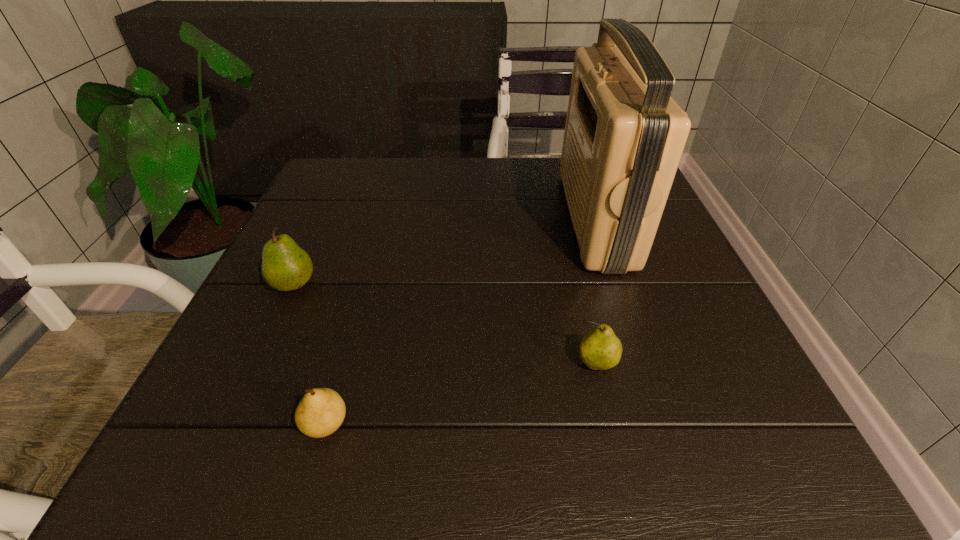
Where is `radio receiver`? radio receiver is located at coordinates (624, 136).

Locate an element on the screen. The width and height of the screenshot is (960, 540). the third shortest object is located at coordinates (285, 266).

You are a GUI agent. You are given a task and a screenshot of the screen. Output one action in this format:
    pyautogui.click(x=<x>, y=<y>)
    Task: Click on the tallest pear
    This screenshot has height=540, width=960.
    Given the screenshot: What is the action you would take?
    pyautogui.click(x=285, y=266)

Image resolution: width=960 pixels, height=540 pixels. What are the coordinates of `the second pear from left to right` in the screenshot? It's located at (321, 411).

Find the location of `the nearest object`. the nearest object is located at coordinates (321, 411).

This screenshot has height=540, width=960. Identify the location of the rightmost pear. (601, 349).

Locate an element on the screen. The image size is (960, 540). the second farthest pear is located at coordinates (x=601, y=349).

Identify the location of blank area located on the front-facing side of the tallest object. The height and width of the screenshot is (540, 960). (458, 218).

Locate an element on the screen. Image resolution: width=960 pixels, height=540 pixels. free space located on the front-facing side of the tallest object is located at coordinates (435, 218).

You are a GUI agent. You are given a task and a screenshot of the screen. Output one action in this format:
    pyautogui.click(x=<x>, y=<y>)
    Task: Click on the free location located 0.270m on the front-facing side of the tallest object
    This screenshot has width=960, height=540.
    Given the screenshot: What is the action you would take?
    [x=444, y=218]